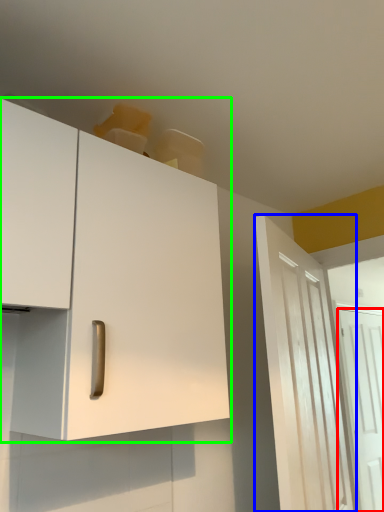
Question: Estimate the real-world distances between objects in this image. Which object is closer to door (highlighted by a red box), door (highlighted by a blue box) or cabinetry (highlighted by a green box)?

Choices:
 (A) door
 (B) cabinetry

Answer: (A)